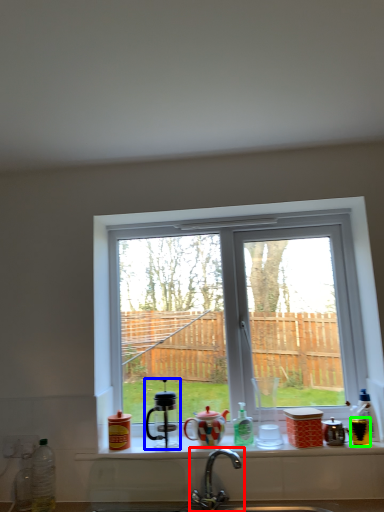
Question: Which is farther away from tap (highlighted by a red box)? appliance (highlighted by a blue box) or appliance (highlighted by a green box)?

Choices:
 (A) appliance
 (B) appliance

Answer: (B)